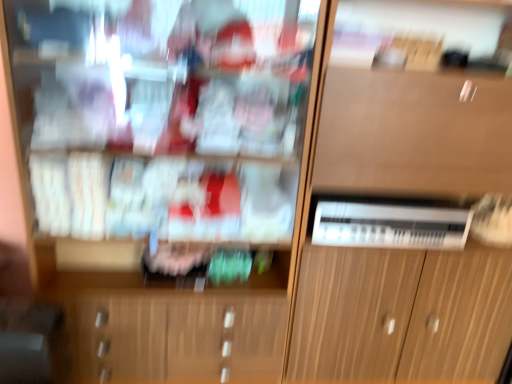
The height and width of the screenshot is (384, 512). Find the location of `white plastic appliance at center`. white plastic appliance at center is located at coordinates (389, 223).

I want to click on wooden cabinet at center, so click(x=406, y=205).

Describe the element at coordinates (406, 205) in the screenshot. I see `wooden cabinet at center` at that location.

Describe the element at coordinates (162, 116) in the screenshot. I see `wooden cabinet at center` at that location.

I want to click on wooden cabinet at center, so click(162, 116).

Identify the location of white plastic appliance at center. This screenshot has height=384, width=512. tap(389, 223).

Between point (216, 59) and point (426, 201), which one is positioned in front?

The point (216, 59) is in front.

How much distance is there between wooden cabinet at center and white plastic appliance at center?

wooden cabinet at center and white plastic appliance at center are 22.18 inches apart from each other.

Is wooden cabinet at center oriented away from white plastic appliance at center?

No, wooden cabinet at center's orientation is not away from white plastic appliance at center.

Looking at their sizes, would you say wooden cabinet at center is wider or thinner than white plastic appliance at center?

Clearly, wooden cabinet at center has more width compared to white plastic appliance at center.

Considering the relative sizes of wooden cabinet at center and white plastic appliance at center in the image provided, is wooden cabinet at center wider than white plastic appliance at center?

Correct, the width of wooden cabinet at center exceeds that of white plastic appliance at center.

In order to click on cabinetry in front of the white plastic appliance at center in this screenshot , I will do `click(406, 205)`.

Can you confirm if wooden cabinet at center is shorter than white plastic appliance at center?

In fact, wooden cabinet at center may be taller than white plastic appliance at center.

Which is farther from the camera, (352, 50) or (318, 215)?

The point (352, 50) is behind.

In terms of height, does wooden cabinet at center look taller or shorter compared to wooden cabinet at center?

Clearly, wooden cabinet at center is shorter compared to wooden cabinet at center.

Does wooden cabinet at center come behind wooden cabinet at center?

No, wooden cabinet at center is in front of wooden cabinet at center.

Does wooden cabinet at center contain wooden cabinet at center?

Actually, wooden cabinet at center is outside wooden cabinet at center.

Is white plastic appliance at center bigger than wooden cabinet at center?

Actually, white plastic appliance at center might be smaller than wooden cabinet at center.

Which of these two, white plastic appliance at center or wooden cabinet at center, is wider?

wooden cabinet at center.

Which is correct: white plastic appliance at center is inside wooden cabinet at center, or outside of it?

white plastic appliance at center is outside wooden cabinet at center.

Is white plastic appliance at center positioned far away from wooden cabinet at center?

No, white plastic appliance at center is in close proximity to wooden cabinet at center.

Does point (344, 36) appear closer or farther from the camera than point (55, 137)?

Point (344, 36) is positioned farther from the camera compared to point (55, 137).

From the image's perspective, which is above, wooden cabinet at center or wooden cabinet at center?

From the image's view, wooden cabinet at center is above.

From a real-world perspective, is wooden cabinet at center located beneath wooden cabinet at center?

No.

In the image, is wooden cabinet at center on the left side or the right side of wooden cabinet at center?

wooden cabinet at center is positioned on wooden cabinet at center's right side.

Does white plastic appliance at center have a lesser height compared to wooden cabinet at center?

Indeed, white plastic appliance at center has a lesser height compared to wooden cabinet at center.

Where is `cabinetry that appears in front of the white plastic appliance at center`? This screenshot has width=512, height=384. cabinetry that appears in front of the white plastic appliance at center is located at coordinates (406, 205).

From the image's perspective, is white plastic appliance at center on wooden cabinet at center?

Correct, white plastic appliance at center appears higher than wooden cabinet at center in the image.

Which is more to the right, white plastic appliance at center or wooden cabinet at center?

wooden cabinet at center.

Locate an element on the screen. shelf on the left of white plastic appliance at center is located at coordinates (162, 116).

Locate an element on the screen. This screenshot has height=384, width=512. appliance that is above the wooden cabinet at center (from a real-world perspective) is located at coordinates (389, 223).

Which object lies nearer to the anchor point wooden cabinet at center, white plastic appliance at center or wooden cabinet at center?

Among the two, wooden cabinet at center is located nearer to wooden cabinet at center.

Looking at the image, which one is located further to white plastic appliance at center, wooden cabinet at center or wooden cabinet at center?

wooden cabinet at center.

Estimate the real-world distances between objects in this image. Which object is further from wooden cabinet at center, wooden cabinet at center or white plastic appliance at center?

wooden cabinet at center is positioned further to the anchor wooden cabinet at center.

From the image, which object appears to be nearer to wooden cabinet at center, wooden cabinet at center or white plastic appliance at center?

Among the two, wooden cabinet at center is located nearer to wooden cabinet at center.

Considering their positions, is white plastic appliance at center positioned further to wooden cabinet at center than wooden cabinet at center?

wooden cabinet at center is positioned further to the anchor wooden cabinet at center.

Which object lies further to the anchor point white plastic appliance at center, wooden cabinet at center or wooden cabinet at center?

Based on the image, wooden cabinet at center appears to be further to white plastic appliance at center.

Where is `appliance between wooden cabinet at center and wooden cabinet at center`? appliance between wooden cabinet at center and wooden cabinet at center is located at coordinates (389, 223).